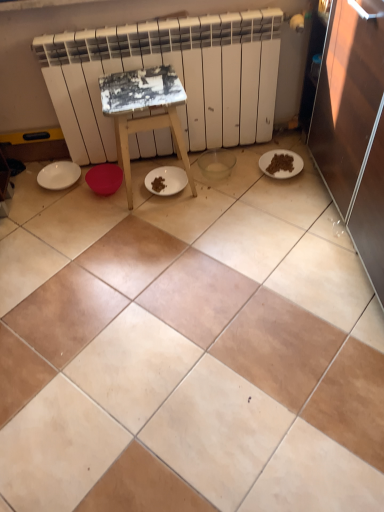
The height and width of the screenshot is (512, 384). I want to click on vacant space underneath white matte plate at lower right, which is the 2th paper plate from left to right (from a real-world perspective), so click(x=272, y=160).